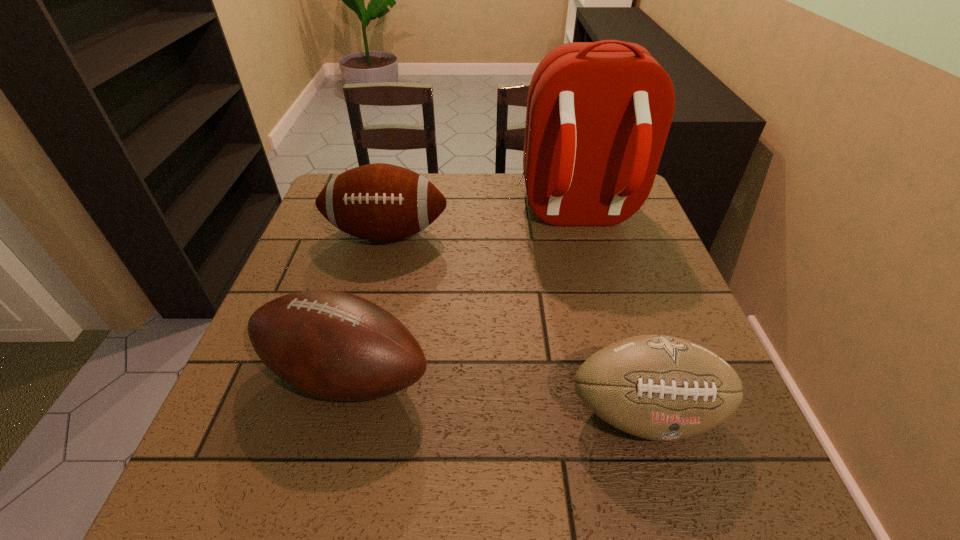
Identify the location of football (American) at the right edge. (657, 387).

Find the location of a particular element. The image size is (960, 540). object at the far left corner is located at coordinates (379, 202).

Locate an element on the screen. This screenshot has width=960, height=540. object that is at the far right corner is located at coordinates (598, 114).

Locate an element on the screen. This screenshot has width=960, height=540. object that is at the near right corner is located at coordinates (657, 387).

Locate an element on the screen. This screenshot has width=960, height=540. free space at the far edge of the desktop is located at coordinates (470, 206).

Where is `vacant space at the left edge`? The image size is (960, 540). vacant space at the left edge is located at coordinates coord(317,256).

In order to click on vacant region at the right edge of the desktop in this screenshot , I will do `click(619, 226)`.

The width and height of the screenshot is (960, 540). In the image, there is a desktop. What are the coordinates of `blank space at the near left corner` in the screenshot? It's located at (285, 467).

At what (x,y) coordinates should I click in order to perform the action: click on free spot at the near right corner of the desktop. Please return your answer as a coordinate pair (x, y). The height and width of the screenshot is (540, 960). Looking at the image, I should click on (687, 494).

Image resolution: width=960 pixels, height=540 pixels. Find the location of `vacant region between the tallest object and the rightmost football (American)`. vacant region between the tallest object and the rightmost football (American) is located at coordinates (611, 314).